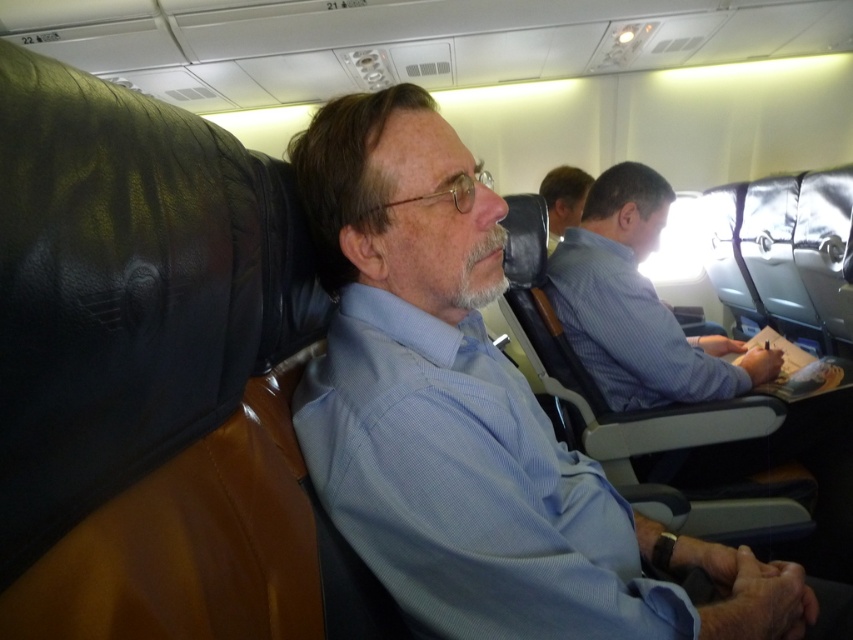
You are a flight attendant walking down the aisle and see the blue textured shirt at center and the light blue shirt at center. Which passenger are you closer to?

The blue textured shirt at center is in front of the light blue shirt at center, so you are closer to the blue textured shirt at center.

You are a flight attendant standing at the back of the airplane cabin. You need to hand a drink to the passenger wearing the blue fabric shirt at center. Can you reach them without moving closer? The minimum distance required to serve is 25 inches.

The blue fabric shirt at center is 24.95 inches from the camera, which is slightly less than the required 25 inches. Therefore, you cannot reach them without moving closer to ensure proper service distance.